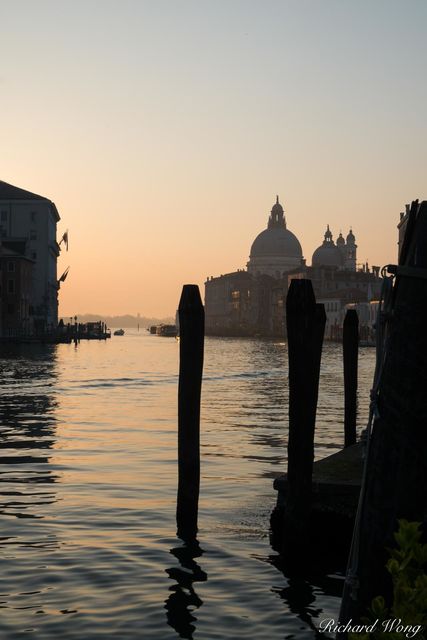
Identify the location of plant. This screenshot has height=640, width=427. (409, 595).